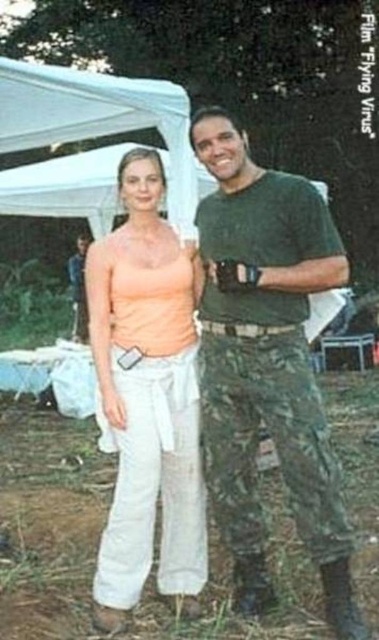
Question: Is green camouflage pants at right bigger than matte peach tank top at center?

Choices:
 (A) yes
 (B) no

Answer: (A)

Question: Which object appears farthest from the camera in this image?

Choices:
 (A) matte peach tank top at center
 (B) green camouflage pants at right

Answer: (A)

Question: Is green camouflage pants at right positioned at the back of matte peach tank top at center?

Choices:
 (A) yes
 (B) no

Answer: (B)

Question: From the image, what is the correct spatial relationship of green camouflage pants at right in relation to matte peach tank top at center?

Choices:
 (A) below
 (B) above

Answer: (B)